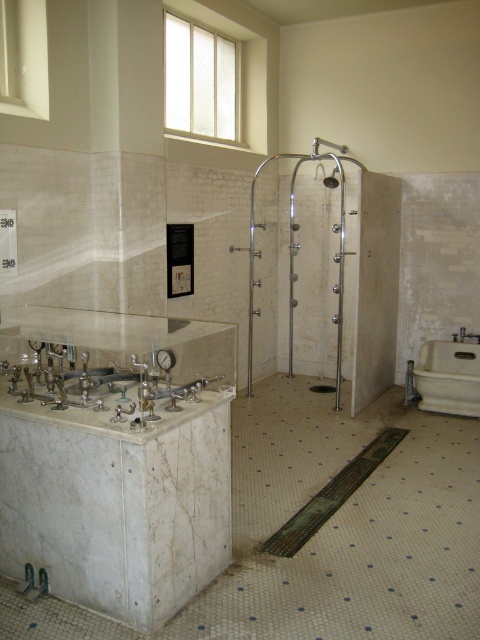
You are a maintenance worker in a hospital bathroom. You need to check if the satin nickel shower head at upper center can directly spray water into the white porcelain bathtub at lower right. Based on their positions, can the shower head spray water into the bathtub?

The white porcelain bathtub at lower right is below the satin nickel shower head at upper center, so yes, the shower head can directly spray water into the bathtub.

You are a maintenance worker checking the bathroom fixtures. You need to determine which fixture is taller between the white marble sink at lower left and the white porcelain bathtub at lower right. Based on the scene, which one is taller?

The white marble sink at lower left is shorter than the white porcelain bathtub at lower right, so the bathtub is taller.